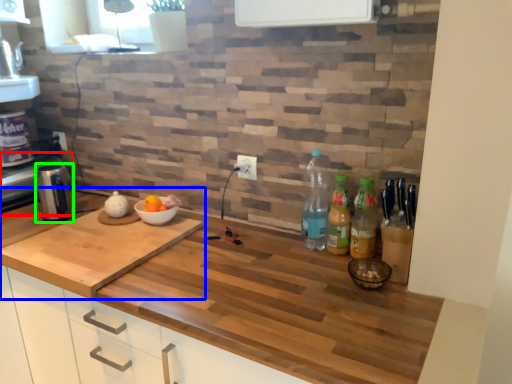
Question: Estimate the real-world distances between objects in this image. Which object is farther from appliance (highlighted by a red box), countertop (highlighted by a blue box) or coffee machine (highlighted by a green box)?

Choices:
 (A) countertop
 (B) coffee machine

Answer: (A)